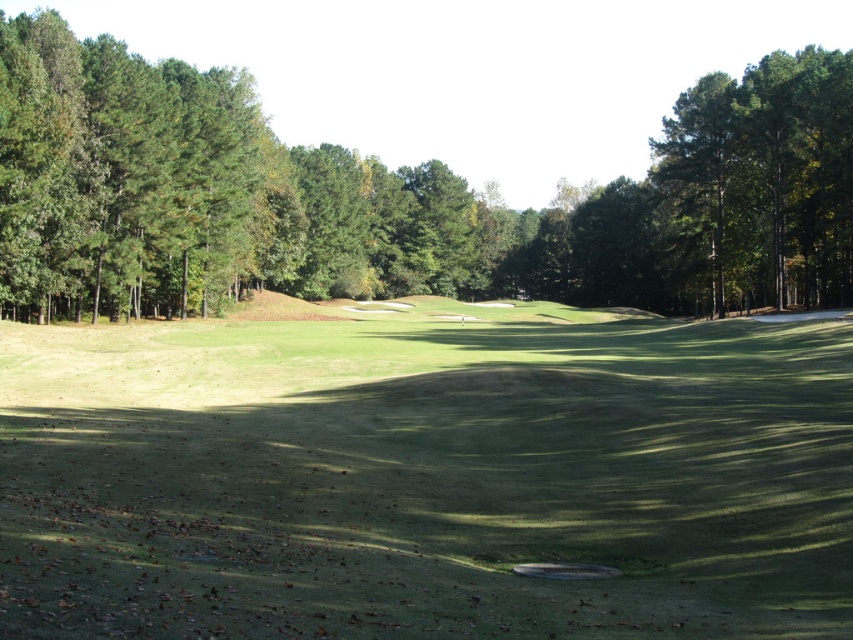
Is green grassy field at center above green leafy tree at center?

No, green grassy field at center is not above green leafy tree at center.

Who is taller, green grassy field at center or green leafy tree at center?

Standing taller between the two is green leafy tree at center.

This screenshot has width=853, height=640. Identify the location of green grassy field at center. (425, 476).

I want to click on green grassy field at center, so click(x=425, y=476).